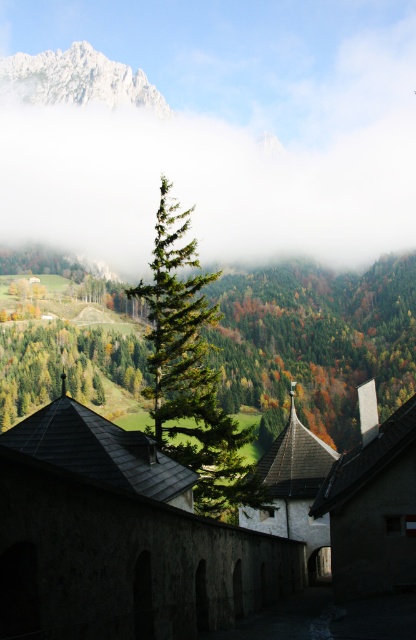
Question: Which point is farther to the camera?

Choices:
 (A) (146, 337)
 (B) (218, 237)
 (C) (257, 273)
 (D) (136, 74)

Answer: (D)

Question: Which object is positioned closest to the white rocky mountain at upper left?

Choices:
 (A) green matte tree at center
 (B) green needle-like tree at center

Answer: (A)

Question: Estimate the real-world distances between objects in this image. Which object is closer to the green matte tree at center?

Choices:
 (A) white rocky mountain at upper left
 (B) green needle-like tree at center
 (C) white fluffy cloud at upper center

Answer: (B)

Question: Considering the relative positions of white fluffy cloud at upper center and green matte tree at center in the image provided, where is white fluffy cloud at upper center located with respect to green matte tree at center?

Choices:
 (A) above
 (B) below

Answer: (A)

Question: Does white fluffy cloud at upper center lie in front of green needle-like tree at center?

Choices:
 (A) no
 (B) yes

Answer: (A)

Question: Is green matte tree at center wider than white rocky mountain at upper left?

Choices:
 (A) no
 (B) yes

Answer: (B)